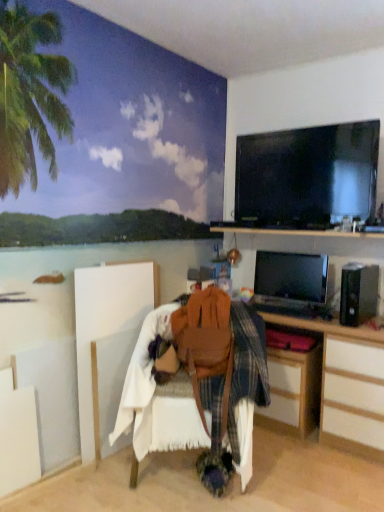
Question: From the image's perspective, is wooden desk at lower right beneath black glossy screen at upper right, the first television positioned from the top?

Choices:
 (A) yes
 (B) no

Answer: (A)

Question: Can we say wooden desk at lower right lies outside black glossy screen at upper right, the second television positioned from the bottom?

Choices:
 (A) no
 (B) yes

Answer: (B)

Question: Is wooden desk at lower right taller than black glossy screen at upper right, the first television positioned from the top?

Choices:
 (A) yes
 (B) no

Answer: (A)

Question: Can you confirm if wooden desk at lower right is positioned to the left of black glossy screen at upper right, the first television positioned from the top?

Choices:
 (A) no
 (B) yes

Answer: (B)

Question: Is wooden desk at lower right turned away from black glossy screen at upper right, the first television positioned from the top?

Choices:
 (A) no
 (B) yes

Answer: (A)

Question: In the image, is ocean mural at upper left positioned in front of or behind satin black monitor at right, which ranks as the first television in bottom-to-top order?

Choices:
 (A) front
 (B) behind

Answer: (A)

Question: Is ocean mural at upper left wider or thinner than satin black monitor at right, which is the 2th television in top-to-bottom order?

Choices:
 (A) thin
 (B) wide

Answer: (B)

Question: Is ocean mural at upper left bigger or smaller than satin black monitor at right, which ranks as the first television in bottom-to-top order?

Choices:
 (A) big
 (B) small

Answer: (A)

Question: Is ocean mural at upper left to the left or to the right of satin black monitor at right, which ranks as the first television in bottom-to-top order, in the image?

Choices:
 (A) left
 (B) right

Answer: (A)

Question: In the image, is ocean mural at upper left positioned in front of or behind leather at center?

Choices:
 (A) behind
 (B) front

Answer: (B)

Question: Is ocean mural at upper left spatially inside leather at center, or outside of it?

Choices:
 (A) outside
 (B) inside

Answer: (A)

Question: In terms of size, does ocean mural at upper left appear bigger or smaller than leather at center?

Choices:
 (A) small
 (B) big

Answer: (A)

Question: Considering the relative positions of ocean mural at upper left and leather at center in the image provided, is ocean mural at upper left to the left or to the right of leather at center?

Choices:
 (A) left
 (B) right

Answer: (A)

Question: Would you say brown leather bag at center is to the left or to the right of wooden desk at lower right in the picture?

Choices:
 (A) right
 (B) left

Answer: (B)

Question: Considering the positions of brown leather bag at center and wooden desk at lower right in the image, is brown leather bag at center wider or thinner than wooden desk at lower right?

Choices:
 (A) wide
 (B) thin

Answer: (B)